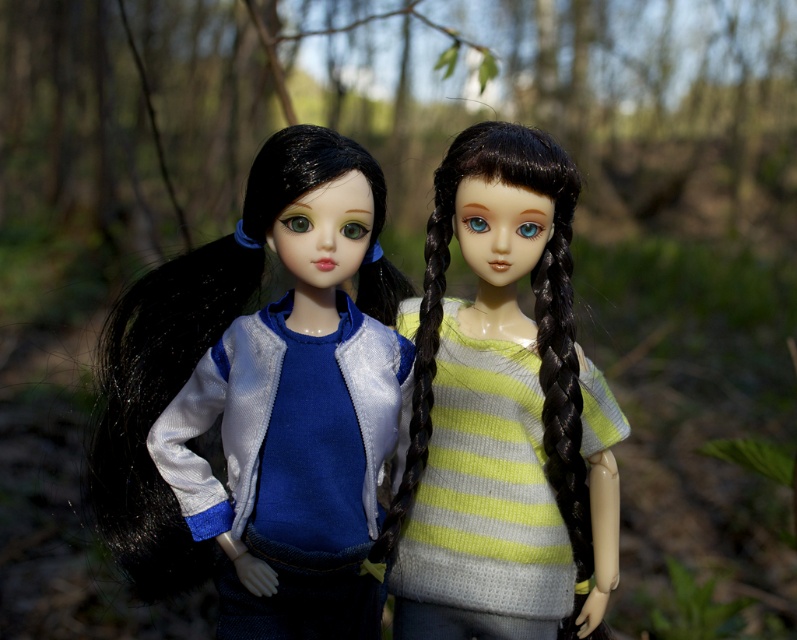
Question: Can you confirm if satin blue dress at center is positioned above matte black hair at center?

Choices:
 (A) yes
 (B) no

Answer: (B)

Question: From the image, what is the correct spatial relationship of knitted yellow-green striped sweater at center in relation to matte black hair at center?

Choices:
 (A) right
 (B) left

Answer: (A)

Question: Can you confirm if knitted yellow-green striped sweater at center is thinner than blue corduroy sweater at center?

Choices:
 (A) no
 (B) yes

Answer: (A)

Question: Estimate the real-world distances between objects in this image. Which object is farther from the blue corduroy sweater at center?

Choices:
 (A) satin blue dress at center
 (B) knitted yellow-green striped sweater at center

Answer: (B)

Question: Which object appears closest to the camera in this image?

Choices:
 (A) blue corduroy sweater at center
 (B) matte black hair at center
 (C) satin blue dress at center
 (D) knitted yellow-green striped sweater at center

Answer: (C)

Question: Among these objects, which one is farthest from the camera?

Choices:
 (A) blue corduroy sweater at center
 (B) knitted yellow-green striped sweater at center
 (C) satin blue dress at center

Answer: (B)